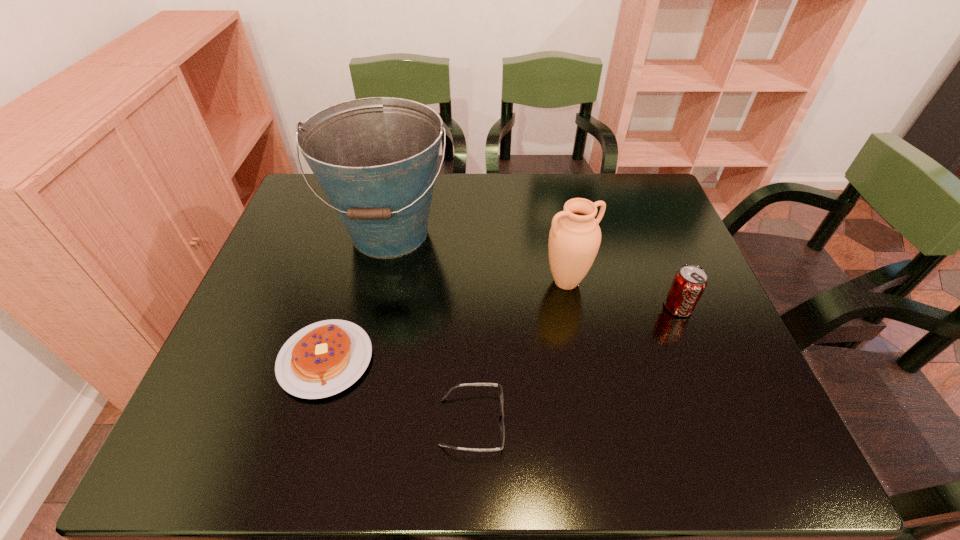
The width and height of the screenshot is (960, 540). Identify the location of empty space between the tallest object and the sunglasses. (431, 327).

I want to click on free space between the fourth tallest object and the third tallest object, so click(x=502, y=333).

I want to click on vacant area that lies between the sunglasses and the fourth object from left to right, so point(519,352).

Where is `vacant area that lies between the second tallest object and the sunglasses`? The image size is (960, 540). vacant area that lies between the second tallest object and the sunglasses is located at coordinates (519, 352).

What are the coordinates of `unoccupied position between the urn and the third object from left to right` in the screenshot? It's located at (519, 352).

Select which object appears as the second closest to the second shortest object. Please provide its 2D coordinates. Your answer should be formatted as a tuple, i.e. [(x, y)], where the tuple contains the x and y coordinates of a point satisfying the conditions above.

[(502, 427)]

Identify which object is located as the second nearest to the third object from right to left. Please provide its 2D coordinates. Your answer should be formatted as a tuple, i.e. [(x, y)], where the tuple contains the x and y coordinates of a point satisfying the conditions above.

[(574, 239)]

This screenshot has height=540, width=960. What are the coordinates of `free spot that satisfies the following two spatial constraints: 1. with the handle on opposite sides of the urn; 2. on the left side of the tallest object` in the screenshot? It's located at [x=379, y=282].

You are a GUI agent. You are given a task and a screenshot of the screen. Output one action in this format:
    pyautogui.click(x=<x>, y=<y>)
    Task: Click on the vacant space that satisfies the following two spatial constraints: 1. on the front side of the second object from right to left; 2. on the front-facing side of the shortest object
    Image resolution: width=960 pixels, height=540 pixels.
    Given the screenshot: What is the action you would take?
    pyautogui.click(x=592, y=422)

Identify the location of vacant space that satisfies the following two spatial constraints: 1. with the handle on opposite sides of the third tallest object; 2. on the left side of the tallest object. The height and width of the screenshot is (540, 960). (374, 307).